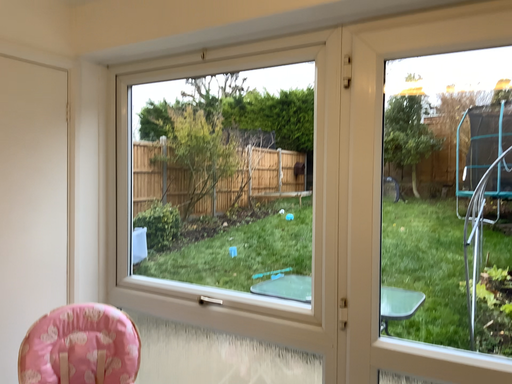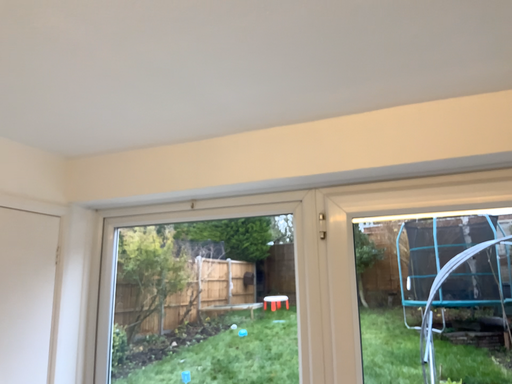
Question: How did the camera likely rotate when shooting the video?

Choices:
 (A) rotated right
 (B) rotated left

Answer: (A)